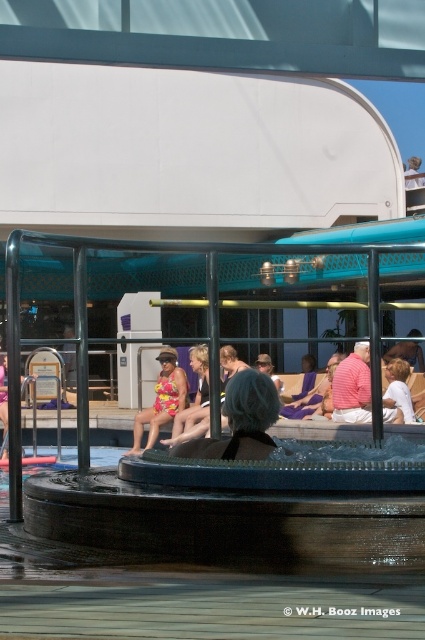
You are standing on the cruise ship deck and want to find the multicolored swimsuit at center. According to the coordinates provided, where should you look to locate it?

The multicolored swimsuit at center is located at coordinates point (195, 403).

You are a lifeguard on duty at the cruise ship deck. You need to quickly reach either the multicolored swimsuit at center or the matte yellow swimsuit at center in case of an emergency. Which one can you reach faster if you start from your current position at the railing near the water feature?

The distance between the multicolored swimsuit at center and the matte yellow swimsuit at center is 3.90 meters. Since both are at the center, you can reach either in the same amount of time if moving directly towards them. However, if one is positioned closer to your starting point at the railing, that one would be reached faster. The description does not specify their distance from the starting point, only their separation from each other.